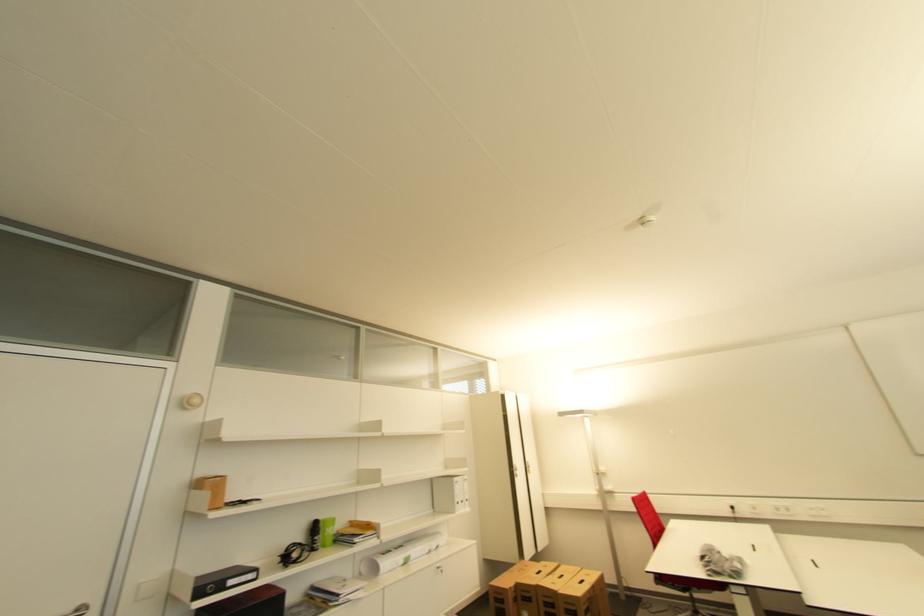
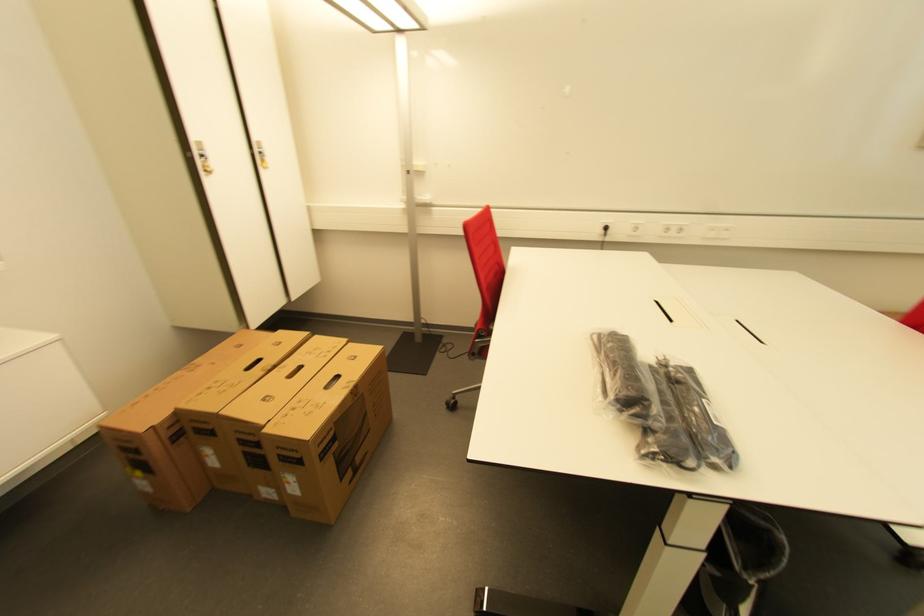
In the second image, find the point that corresponds to (789,513) in the first image.

(676, 233)